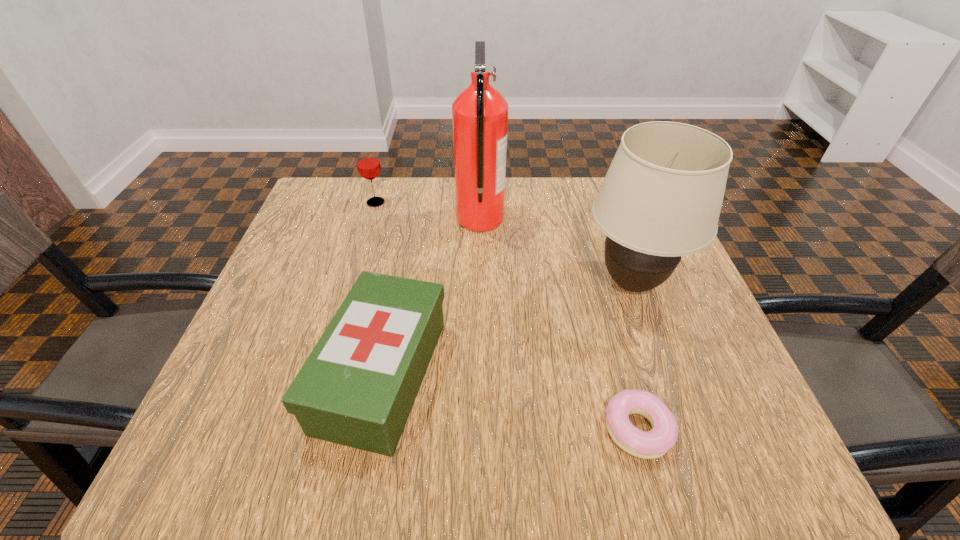
Where is `vacant space situated on the left of the third tallest object`? The width and height of the screenshot is (960, 540). vacant space situated on the left of the third tallest object is located at coordinates pos(338,202).

Locate an element on the screen. This screenshot has width=960, height=540. vacant region located 0.310m on the right of the first-aid kit is located at coordinates (619, 375).

This screenshot has width=960, height=540. I want to click on vacant space located 0.060m on the back of the doughnut, so tap(621, 368).

Identify the location of fire extinguisher that is at the far edge. Image resolution: width=960 pixels, height=540 pixels. (479, 113).

Image resolution: width=960 pixels, height=540 pixels. What are the coordinates of `glass that is at the far edge` in the screenshot? It's located at (368, 164).

Find the location of a particular element. The image size is (960, 540). the first-aid kit that is positioned at the near edge is located at coordinates (357, 387).

Where is `doughnut at the near edge`? This screenshot has height=540, width=960. doughnut at the near edge is located at coordinates (655, 443).

Identify the location of object at the left edge. The width and height of the screenshot is (960, 540). click(x=368, y=164).

This screenshot has width=960, height=540. Find the location of `lampshade positioned at the right edge`. lampshade positioned at the right edge is located at coordinates (661, 198).

Identify the location of doughnut that is positioned at the right edge. (655, 443).